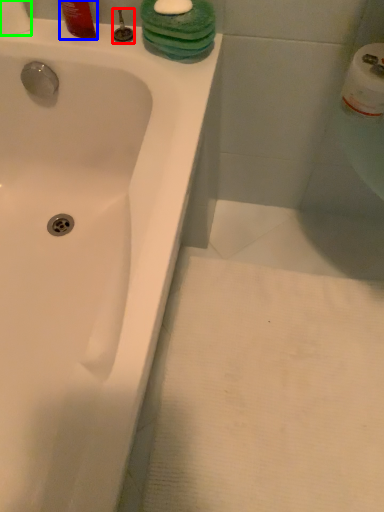
Question: Which is farther away from plumbing fixture (highlighted by a red box)? liquid (highlighted by a blue box) or toilet paper (highlighted by a green box)?

Choices:
 (A) liquid
 (B) toilet paper

Answer: (B)